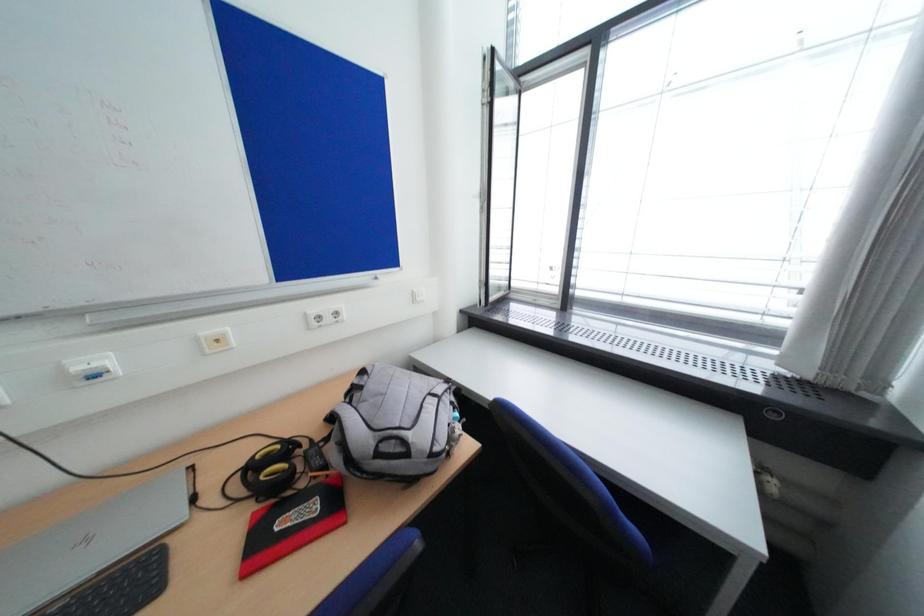
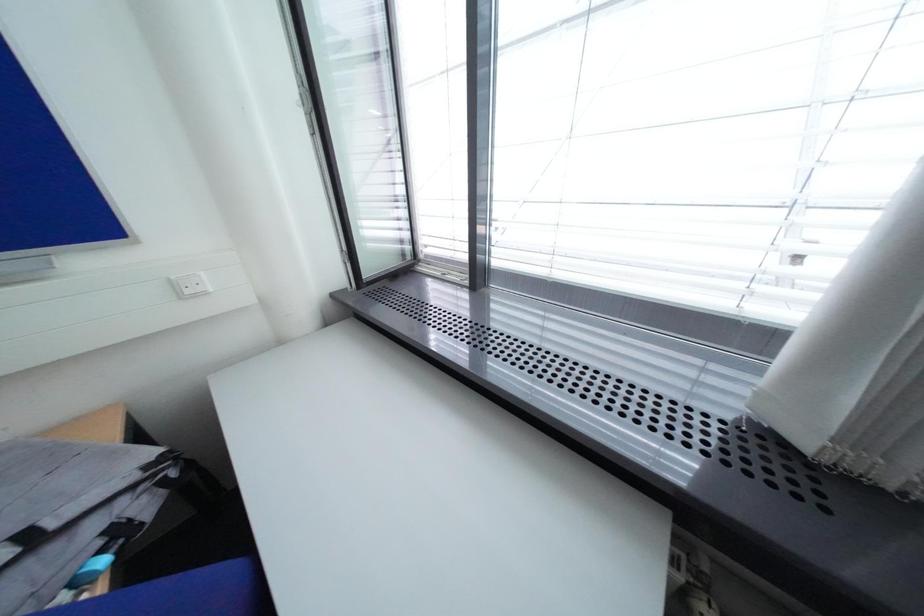
Question: How did the camera likely rotate?

Choices:
 (A) Left
 (B) Right
 (C) Up
 (D) Down

Answer: (D)